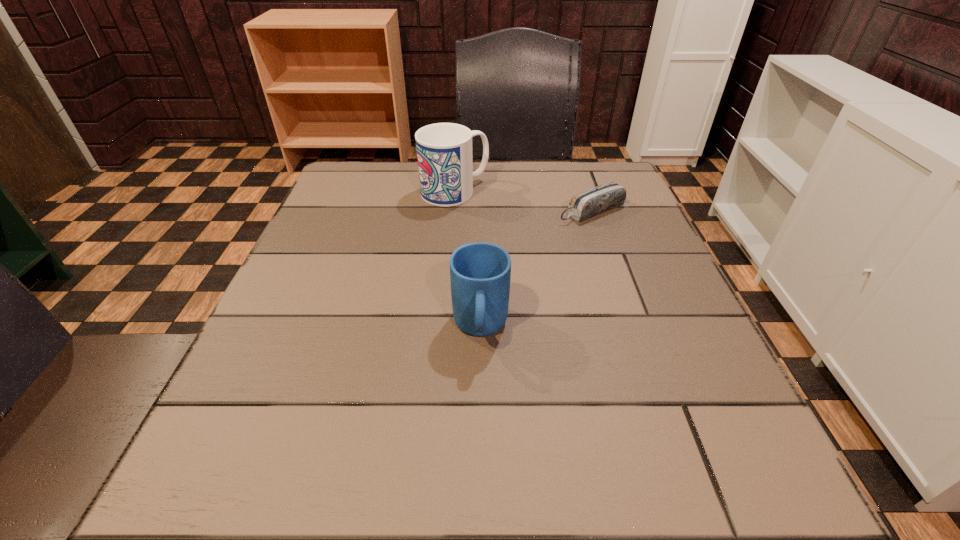
Image resolution: width=960 pixels, height=540 pixels. I want to click on object that is positioned at the right edge, so click(x=591, y=202).

Find the location of a particular element. This screenshot has height=540, width=960. object that is positioned at the far right corner is located at coordinates (591, 202).

Where is `free space at the far edge`? This screenshot has width=960, height=540. free space at the far edge is located at coordinates (560, 171).

Find the location of a particular element. The height and width of the screenshot is (540, 960). vacant region at the near edge is located at coordinates (631, 469).

Where is `free space at the left edge`? The image size is (960, 540). free space at the left edge is located at coordinates (314, 216).

You are a GUI agent. You are given a task and a screenshot of the screen. Output one action in this format:
    pyautogui.click(x=<x>, y=<y>)
    Task: Click on the vacant region at the right edge
    The height and width of the screenshot is (540, 960).
    Given the screenshot: What is the action you would take?
    pyautogui.click(x=620, y=359)

You are a GUI agent. You are given a task and a screenshot of the screen. Output one action in this format:
    pyautogui.click(x=<x>, y=<y>)
    Task: Click on the vacant space at the far right corner of the desktop
    This screenshot has height=540, width=960.
    Given the screenshot: What is the action you would take?
    pyautogui.click(x=629, y=203)

Locate an element on the screen. Image resolution: width=960 pixels, height=540 pixels. vacant area that lies between the farther mug and the shortest object is located at coordinates tap(523, 201).

What are the coordinates of `unoccupied area between the rightmost object and the farther mug` in the screenshot? It's located at (523, 201).

This screenshot has height=540, width=960. I want to click on unoccupied position between the shortest object and the farther mug, so click(523, 201).